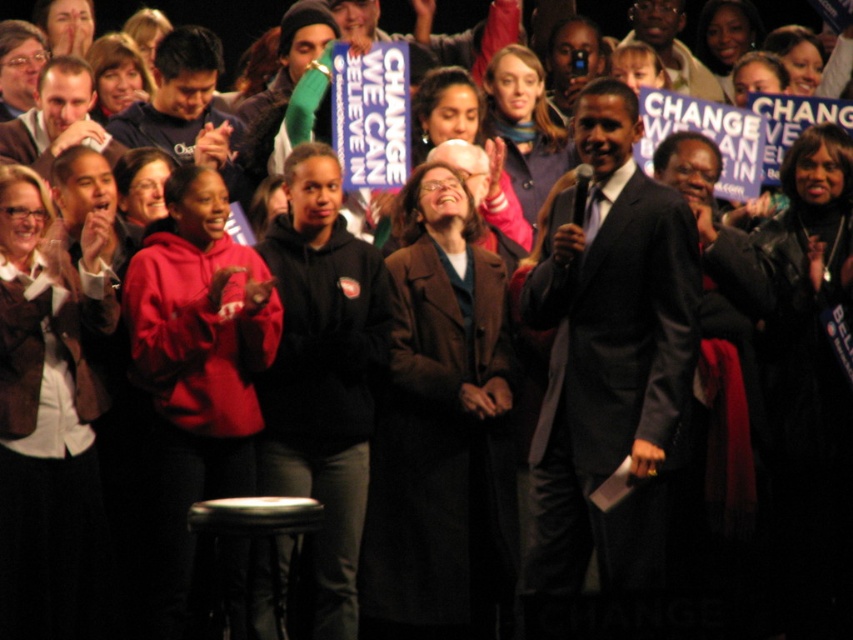
Looking at this image, you are a photographer at the rally and want to capture a photo that includes both the speaker and a specific attendee. The speaker is at point (229,390) and the attendee is at point (276,589). Which point is closer to the camera to ensure both are in focus?

Point (229,390) is closer to the camera than point (276,589). To ensure both are in focus, you should focus on the closer point first.

You are a photographer at the rally and want to capture a photo that includes both the red hoodie at center and the matte brown coat at center. Which one should you position on the left side of your frame to include both in the shot?

The red hoodie at center is already positioned on the left side of the matte brown coat at center, so positioning the red hoodie at center on the left side of your frame will ensure both are included.